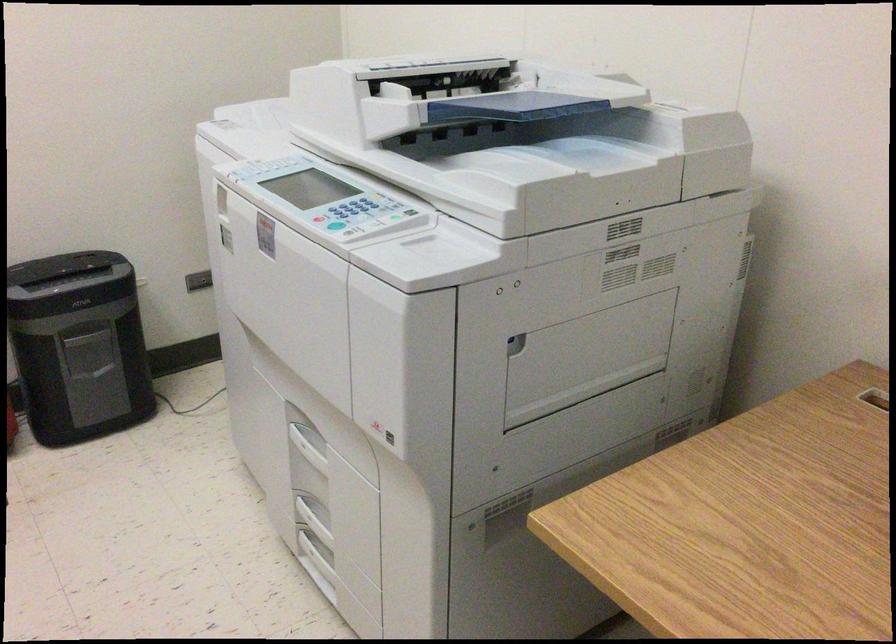
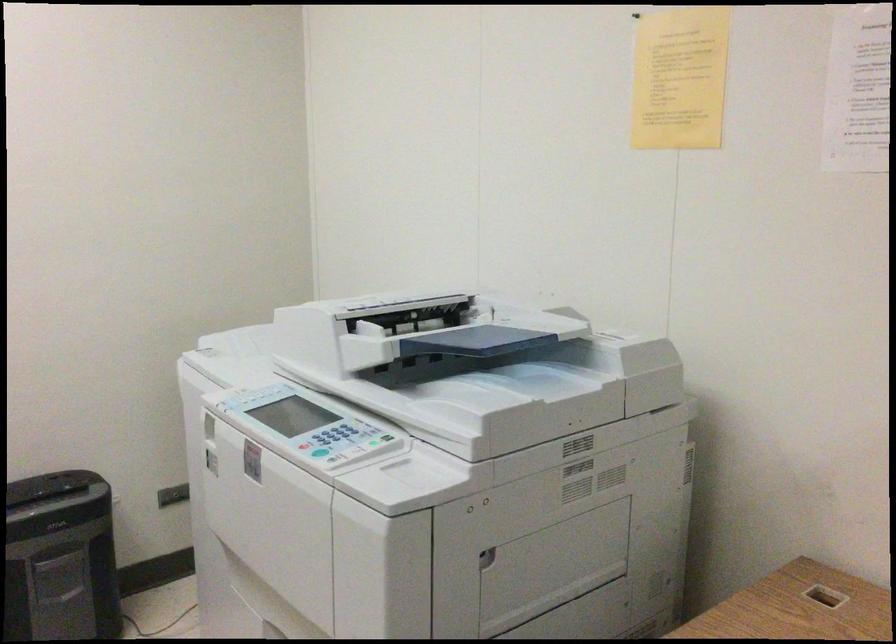
Locate, in the second image, the point that corresponds to pixel 349 212 in the first image.

(332, 438)